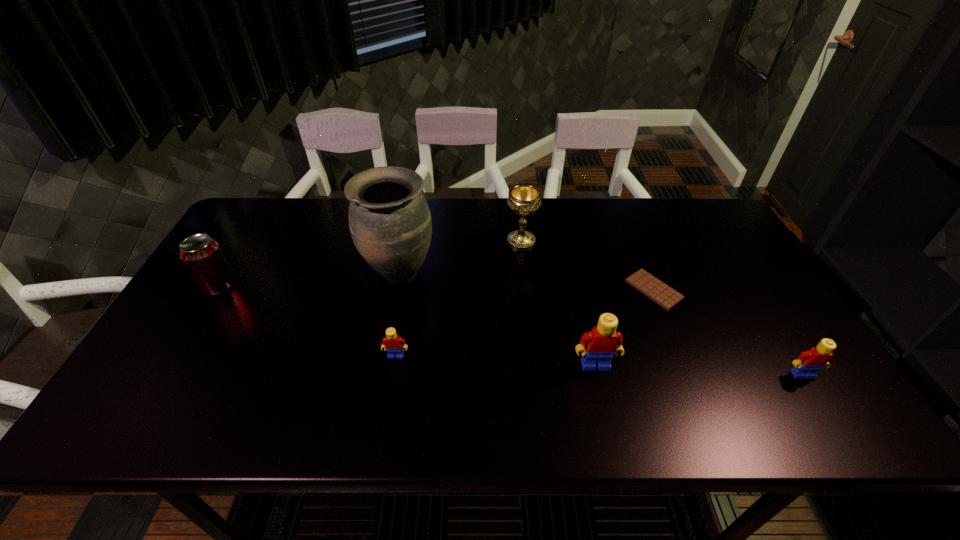
Locate an element on the screen. The height and width of the screenshot is (540, 960). the sixth tallest object is located at coordinates (392, 342).

Locate an element on the screen. Image resolution: width=960 pixels, height=540 pixels. the shortest Lego is located at coordinates (392, 342).

At what (x,y) coordinates should I click in order to perform the action: click on the second Lego from right to left. Please return your answer as a coordinate pair (x, y). Looking at the image, I should click on (603, 341).

Locate an element on the screen. the third object from right to left is located at coordinates 603,341.

The height and width of the screenshot is (540, 960). In order to click on the rightmost Lego in this screenshot , I will do `click(809, 362)`.

Where is `the second tallest Lego`? Image resolution: width=960 pixels, height=540 pixels. the second tallest Lego is located at coordinates (809, 362).

Identify the location of chalice. Image resolution: width=960 pixels, height=540 pixels. (524, 199).

This screenshot has height=540, width=960. What are the coordinates of `soda can` in the screenshot? It's located at (202, 255).

You are a GUI agent. You are given a task and a screenshot of the screen. Output one action in this format:
    pyautogui.click(x=<x>, y=<y>)
    Task: Click on the urn
    The height and width of the screenshot is (540, 960).
    Given the screenshot: What is the action you would take?
    pyautogui.click(x=390, y=223)

You are a GUI agent. You are given a task and a screenshot of the screen. Output one action in this format:
    pyautogui.click(x=<x>, y=<y>)
    Task: Click on the second object from right to left
    
    Given the screenshot: What is the action you would take?
    pyautogui.click(x=665, y=296)